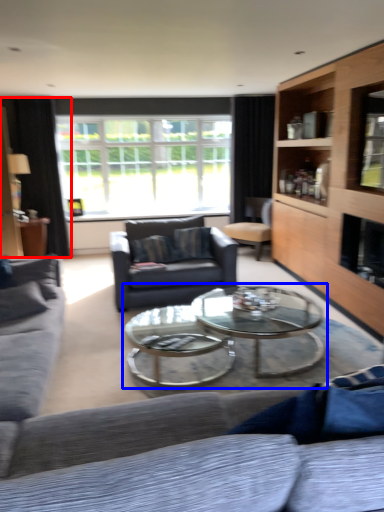
Question: Which object is closer to the camera taking this photo, curtain (highlighted by a red box) or coffee table (highlighted by a blue box)?

Choices:
 (A) curtain
 (B) coffee table

Answer: (B)